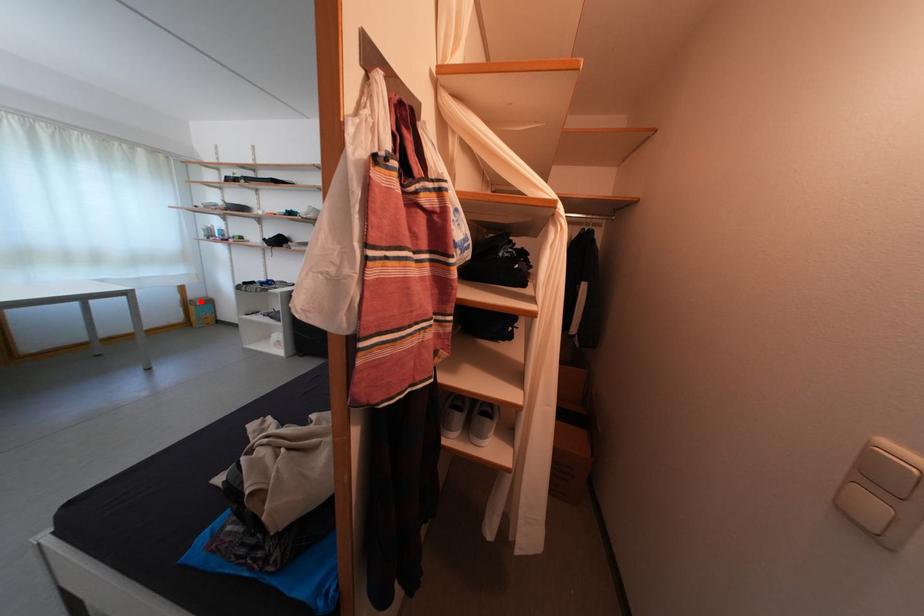
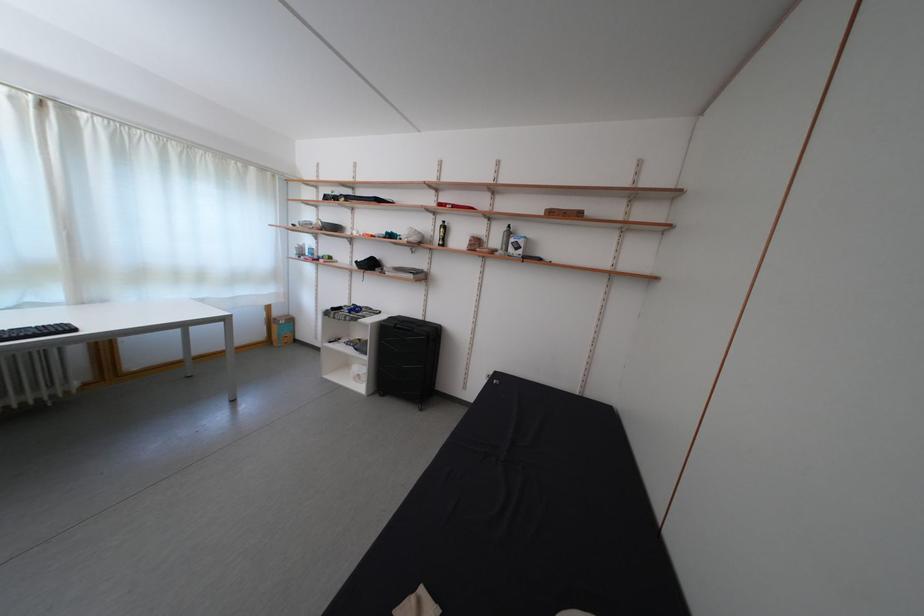
Question: I am providing you with two images of the same scene from different viewpoints. Given a red point in image1, look at the same physical point in image2. Is it:

Choices:
 (A) Closer to the viewpoint
 (B) Farther from the viewpoint

Answer: (B)